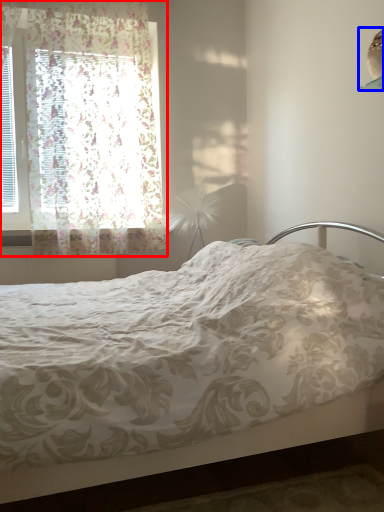
Question: Among these objects, which one is farthest to the camera, window (highlighted by a red box) or lamp (highlighted by a blue box)?

Choices:
 (A) window
 (B) lamp

Answer: (A)